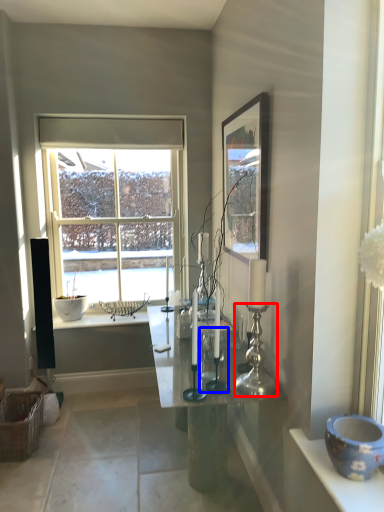
Question: Which object is further to the camera taking this photo, candle holder (highlighted by a red box) or candle holder (highlighted by a blue box)?

Choices:
 (A) candle holder
 (B) candle holder

Answer: (B)